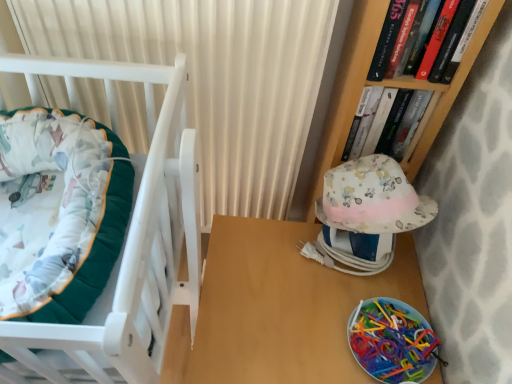
This screenshot has height=384, width=512. What are the coordinates of `empty space that is ontop of translucent plastic plate at lower right (from a real-world perspective)` in the screenshot? It's located at (392, 329).